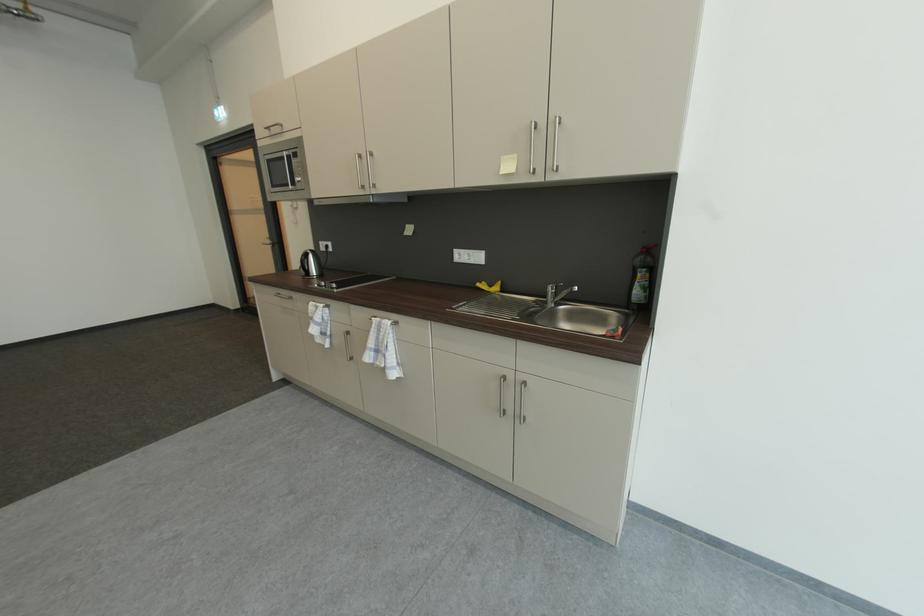
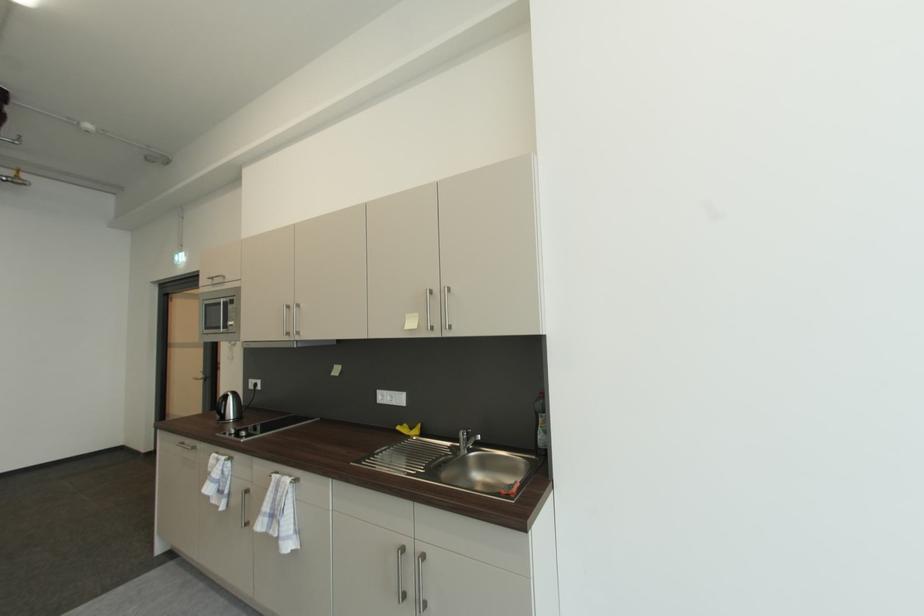
In a continuous first-person perspective shot, in which direction is the camera moving?

The cameraman moved toward right, backward.